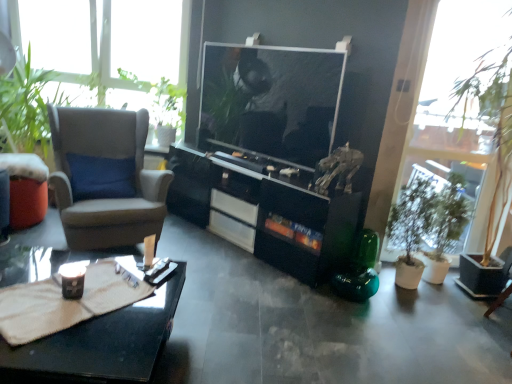
Question: Is green leafy plant at right directly adjacent to green matte plant at right?

Choices:
 (A) no
 (B) yes

Answer: (A)

Question: From a real-world perspective, is green leafy plant at right beneath green matte plant at right?

Choices:
 (A) no
 (B) yes

Answer: (A)

Question: Does green leafy plant at right have a lesser width compared to green matte plant at right?

Choices:
 (A) no
 (B) yes

Answer: (A)

Question: Is green leafy plant at right not inside green matte plant at right?

Choices:
 (A) yes
 (B) no

Answer: (A)

Question: From the image's perspective, would you say green leafy plant at right is positioned over green matte plant at right?

Choices:
 (A) no
 (B) yes

Answer: (B)

Question: From the image's perspective, is green leafy plant at right positioned above or below black glossy cabinet at center?

Choices:
 (A) above
 (B) below

Answer: (A)

Question: Considering the positions of point (495, 82) and point (321, 283), is point (495, 82) closer or farther from the camera than point (321, 283)?

Choices:
 (A) farther
 (B) closer

Answer: (B)

Question: Based on their sizes in the image, would you say green leafy plant at right is bigger or smaller than black glossy cabinet at center?

Choices:
 (A) small
 (B) big

Answer: (B)

Question: Choose the correct answer: Is green leafy plant at right inside black glossy cabinet at center or outside it?

Choices:
 (A) outside
 (B) inside

Answer: (A)

Question: Considering the relative positions of black glossy cabinet at center and gray fabric armchair at left in the image provided, is black glossy cabinet at center to the left or to the right of gray fabric armchair at left?

Choices:
 (A) left
 (B) right

Answer: (B)

Question: Is black glossy cabinet at center spatially inside gray fabric armchair at left, or outside of it?

Choices:
 (A) outside
 (B) inside

Answer: (A)

Question: Relative to gray fabric armchair at left, is black glossy cabinet at center in front or behind?

Choices:
 (A) front
 (B) behind

Answer: (B)

Question: From a real-world perspective, is black glossy cabinet at center physically located above or below gray fabric armchair at left?

Choices:
 (A) below
 (B) above

Answer: (A)

Question: From their relative heights in the image, would you say gray fabric armchair at left is taller or shorter than green leafy plant at right?

Choices:
 (A) short
 (B) tall

Answer: (A)

Question: From a real-world perspective, is gray fabric armchair at left above or below green leafy plant at right?

Choices:
 (A) above
 (B) below

Answer: (B)